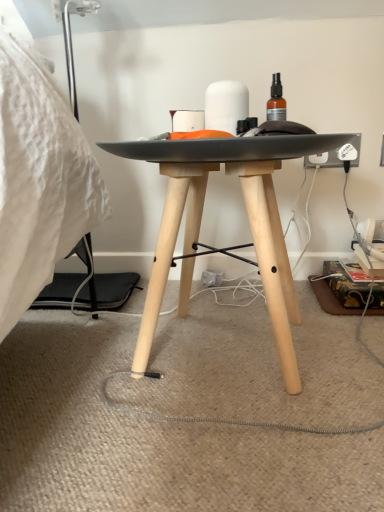
Question: From a real-world perspective, is white matte cylinder at center physically located above or below black cord at lower center?

Choices:
 (A) above
 (B) below

Answer: (A)

Question: Based on their sizes in the image, would you say white matte cylinder at center is bigger or smaller than black cord at lower center?

Choices:
 (A) small
 (B) big

Answer: (A)

Question: Relative to black cord at lower center, is white matte cylinder at center in front or behind?

Choices:
 (A) front
 (B) behind

Answer: (B)

Question: In terms of size, does black cord at lower center appear bigger or smaller than white matte cylinder at center?

Choices:
 (A) big
 (B) small

Answer: (A)

Question: From the image's perspective, is black cord at lower center above or below white matte cylinder at center?

Choices:
 (A) above
 (B) below

Answer: (B)

Question: Do you think black cord at lower center is within white matte cylinder at center, or outside of it?

Choices:
 (A) inside
 (B) outside

Answer: (B)

Question: Is point (125, 372) positioned closer to the camera than point (238, 86)?

Choices:
 (A) farther
 (B) closer

Answer: (B)